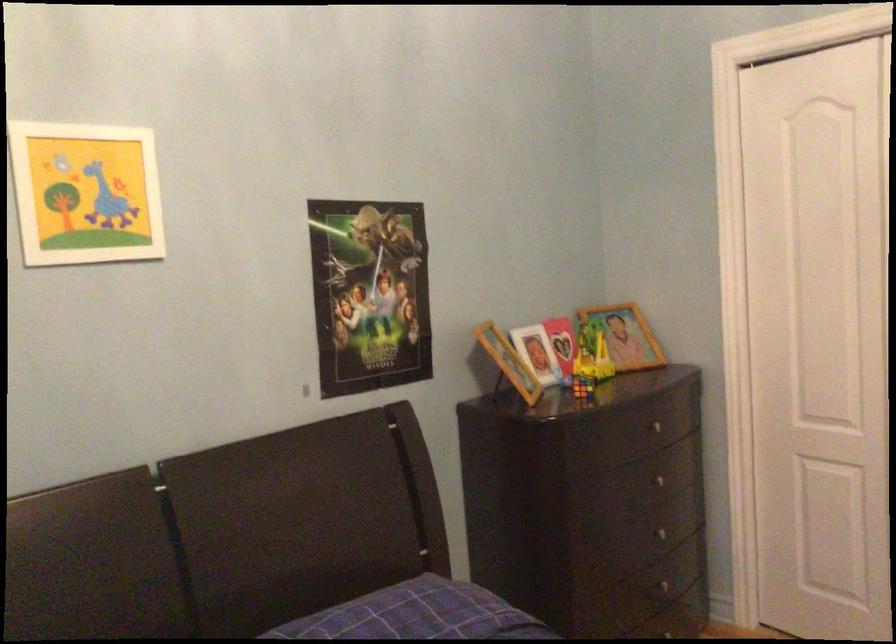
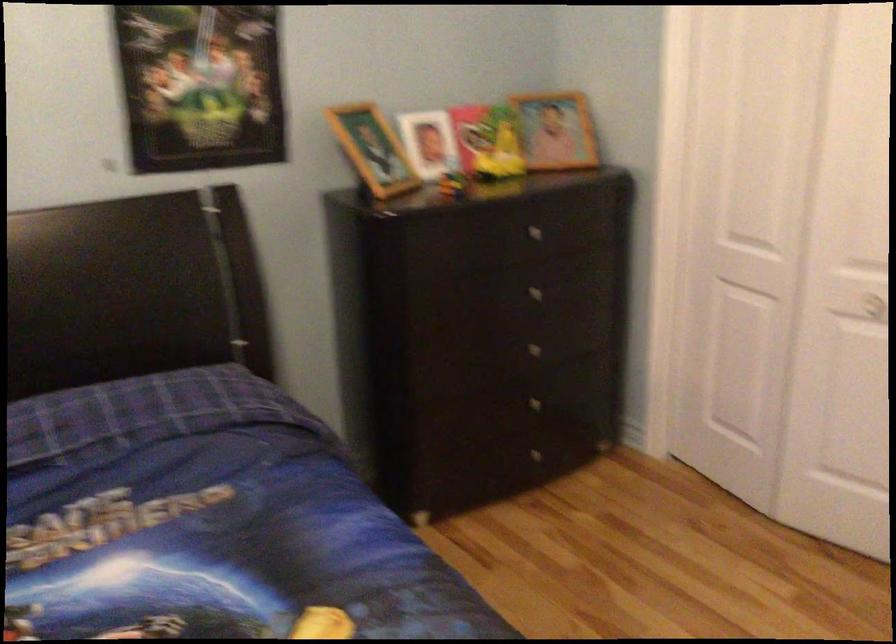
Where in the second image is the point corresponding to point 665,542 from the first image?

(539, 353)